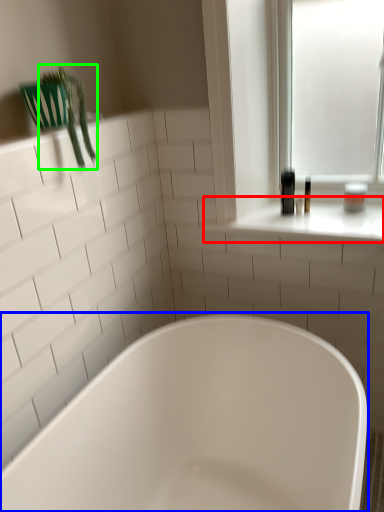
Question: Which object is positioned farthest from window sill (highlighted by a red box)? Select from bathtub (highlighted by a blue box) and plant (highlighted by a green box).

Choices:
 (A) bathtub
 (B) plant

Answer: (B)